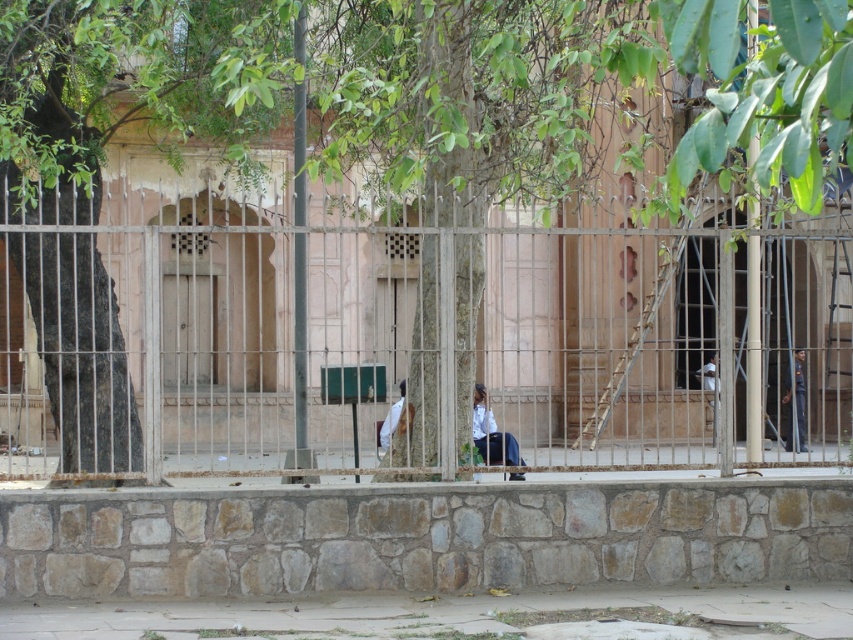
You are a security guard standing in front of the metal security gate. You see a dark blue uniform at right and a white fabric at center. Which object is located to the right of the other?

The dark blue uniform at right is positioned on the right side of white fabric at center.

You are standing in front of the security gate looking at the building. There are two points marked on the wall in front of you. One is at point (799,368) and the other is at point (708,365). Which point is closer to you?

Point (708,365) is closer to you because it is less further to the camera than point (799,368).